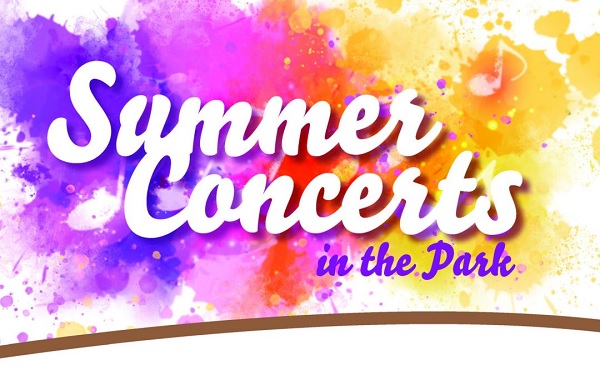
You are a GUI agent. You are given a task and a screenshot of the screen. Output one action in this format:
    pyautogui.click(x=<x>, y=<y>)
    Task: Click on the painted areas of purple
    
    Given the screenshot: What is the action you would take?
    pyautogui.click(x=50, y=59), pyautogui.click(x=430, y=235), pyautogui.click(x=385, y=157), pyautogui.click(x=442, y=82), pyautogui.click(x=6, y=297), pyautogui.click(x=54, y=310), pyautogui.click(x=22, y=332)